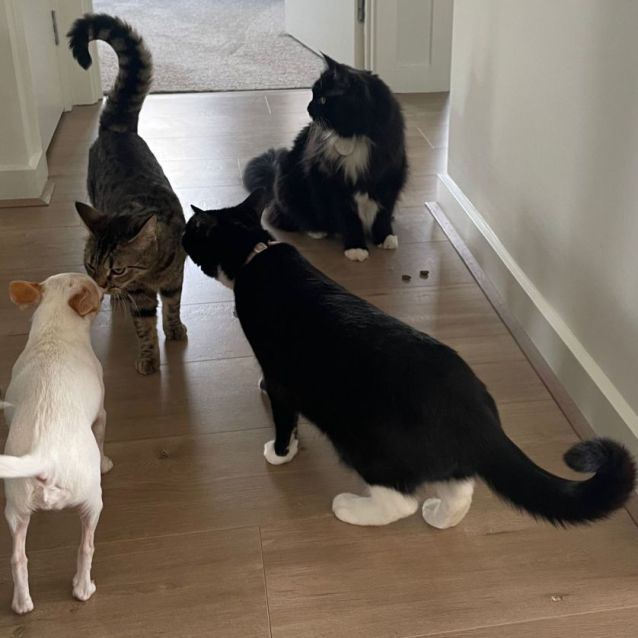
Identify the location of floor. This screenshot has width=638, height=638. (231, 385), (203, 41).